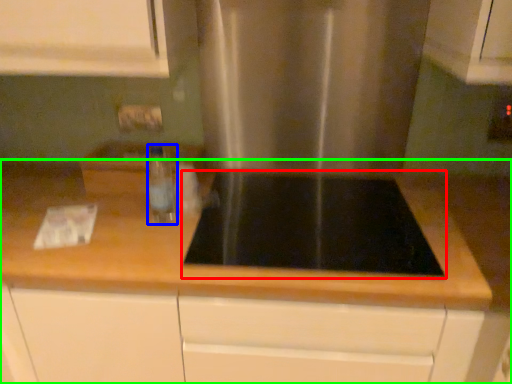
Question: Which is nearer to the gas stove (highlighted by a red box)? bottle (highlighted by a blue box) or countertop (highlighted by a green box).

Choices:
 (A) bottle
 (B) countertop

Answer: (B)